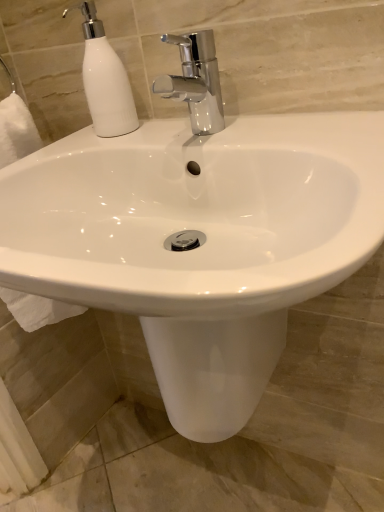
Image resolution: width=384 pixels, height=512 pixels. I want to click on vacant space to the right of white matte soap dispenser at upper left, so click(x=192, y=124).